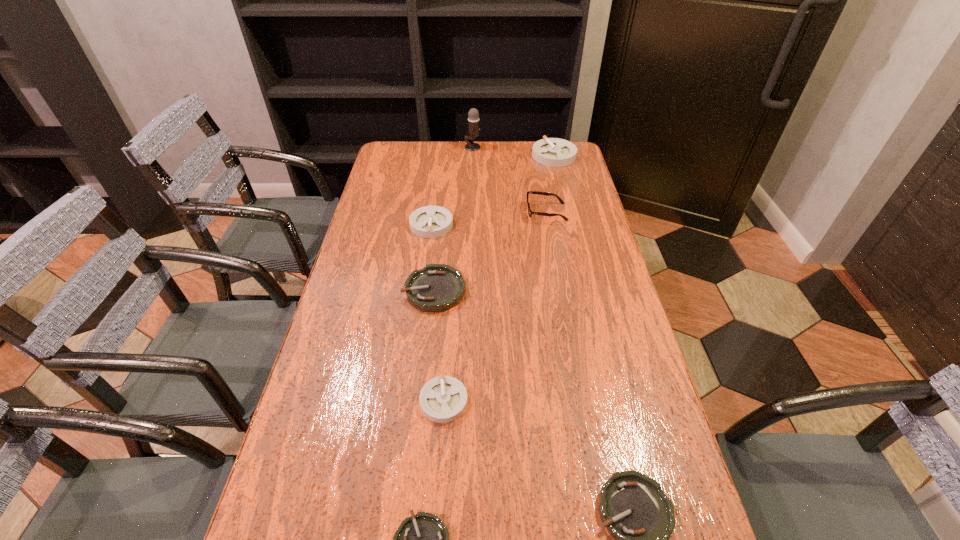
Where is `the nearest gray ashtray`? Image resolution: width=960 pixels, height=540 pixels. the nearest gray ashtray is located at coordinates (443, 399).

What are the coordinates of `vacant space situated on the front of the gray microphone` in the screenshot? It's located at (472, 167).

Find the location of a particular element. This screenshot has height=540, width=960. free point located on the front of the biggest gray ashtray is located at coordinates (568, 213).

In order to click on free space located on the lenses of the spectacles in this screenshot , I will do `click(489, 212)`.

I want to click on vacant space located on the lenses of the spectacles, so click(430, 212).

I want to click on vacant region located 0.190m on the lenses of the spectacles, so click(471, 212).

Find the location of a particular element. This screenshot has height=540, width=960. vacant space situated 0.100m on the back of the second biggest gray ashtray is located at coordinates (435, 195).

The width and height of the screenshot is (960, 540). Find the location of `blank space located on the left of the fourth nearest object`. blank space located on the left of the fourth nearest object is located at coordinates (356, 291).

What are the coordinates of `vacant space located 0.160m on the back of the fourth farthest ashtray` in the screenshot? It's located at (x=448, y=328).

Where is `microphone present at the far edge`? Image resolution: width=960 pixels, height=540 pixels. microphone present at the far edge is located at coordinates (473, 115).